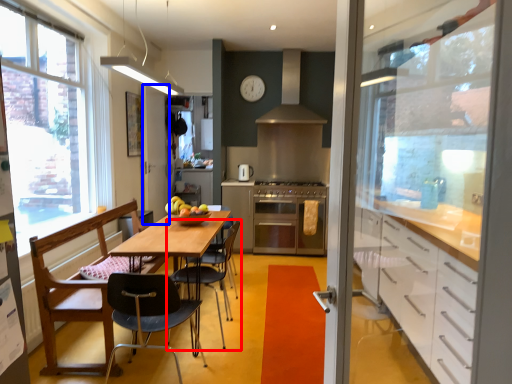
Question: Which of the following is the farthest to the observer, chair (highlighted by a red box) or screen door (highlighted by a blue box)?

Choices:
 (A) chair
 (B) screen door

Answer: (B)